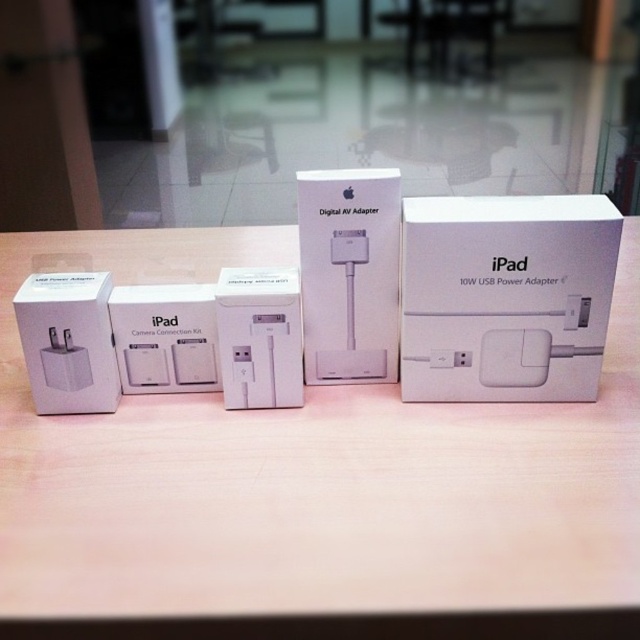
You are setting up an iPad and need to connect both the white matte ipad power adapter at center and the white matte digital av adapter at center. According to the arrangement in the image, which adapter is placed lower on the table?

The white matte ipad power adapter at center is positioned under the white matte digital AV adapter at center, so it is lower on the table.

You are standing in front of the table with Apple accessories. There are two points marked on the table surface. One is at coordinates point [560,502] and the other at point [192,369]. Which of these two points is closer to you?

Point [560,502] is closer to the viewer than point [192,369].

You are setting up a display for Apple accessories. You have a white matte iPad power adapter at center and a white matte digital AV adapter at center. Which one should you place in a larger display space to accommodate their size?

The white matte iPad power adapter at center is larger than the white matte digital AV adapter at center, so it requires a larger display space.